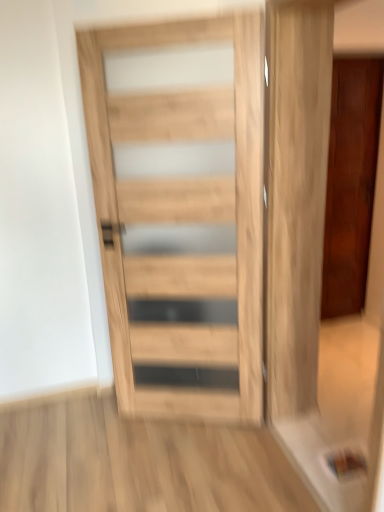
Question: Does shiny dark wood door at right, which ranks as the first door in back-to-front order, have a greater height compared to natural wood door at center, the 1th door from the front?

Choices:
 (A) no
 (B) yes

Answer: (B)

Question: Is natural wood door at center, the first door in the left-to-right sequence, completely or partially inside shiny dark wood door at right, arranged as the second door when viewed from the front?

Choices:
 (A) yes
 (B) no

Answer: (B)

Question: Is shiny dark wood door at right, which ranks as the first door in back-to-front order, looking in the opposite direction of natural wood door at center, which ranks as the second door in back-to-front order?

Choices:
 (A) no
 (B) yes

Answer: (A)

Question: Considering the relative positions of shiny dark wood door at right, arranged as the second door when viewed from the front, and natural wood door at center, arranged as the 2th door when viewed from the right, in the image provided, is shiny dark wood door at right, arranged as the second door when viewed from the front, behind natural wood door at center, arranged as the 2th door when viewed from the right,?

Choices:
 (A) yes
 (B) no

Answer: (A)

Question: From a real-world perspective, is shiny dark wood door at right, which is counted as the first door, starting from the right, physically below natural wood door at center, the 1th door from the front?

Choices:
 (A) no
 (B) yes

Answer: (B)

Question: From the image's perspective, would you say shiny dark wood door at right, which ranks as the first door in back-to-front order, is shown under natural wood door at center, arranged as the 2th door when viewed from the right?

Choices:
 (A) yes
 (B) no

Answer: (B)

Question: Is natural wood door at center, arranged as the 2th door when viewed from the right, taller than shiny dark wood door at right, which ranks as the first door in back-to-front order?

Choices:
 (A) yes
 (B) no

Answer: (B)

Question: Is natural wood door at center, the first door in the left-to-right sequence, at the left side of shiny dark wood door at right, arranged as the second door when viewed from the front?

Choices:
 (A) yes
 (B) no

Answer: (A)

Question: Is the position of natural wood door at center, the 1th door from the front, more distant than that of shiny dark wood door at right, arranged as the second door when viewed from the front?

Choices:
 (A) no
 (B) yes

Answer: (A)

Question: Does natural wood door at center, the 1th door from the front, come in front of shiny dark wood door at right, which is counted as the first door, starting from the right?

Choices:
 (A) yes
 (B) no

Answer: (A)

Question: Could you tell me if natural wood door at center, the first door in the left-to-right sequence, is turned towards shiny dark wood door at right, which is counted as the first door, starting from the right?

Choices:
 (A) yes
 (B) no

Answer: (B)

Question: Is natural wood door at center, arranged as the 2th door when viewed from the right, wider than shiny dark wood door at right, which ranks as the first door in back-to-front order?

Choices:
 (A) yes
 (B) no

Answer: (B)

Question: Considering the positions of natural wood door at center, the 1th door from the front, and shiny dark wood door at right, arranged as the second door when viewed from the left, in the image, is natural wood door at center, the 1th door from the front, taller or shorter than shiny dark wood door at right, arranged as the second door when viewed from the left,?

Choices:
 (A) short
 (B) tall

Answer: (A)